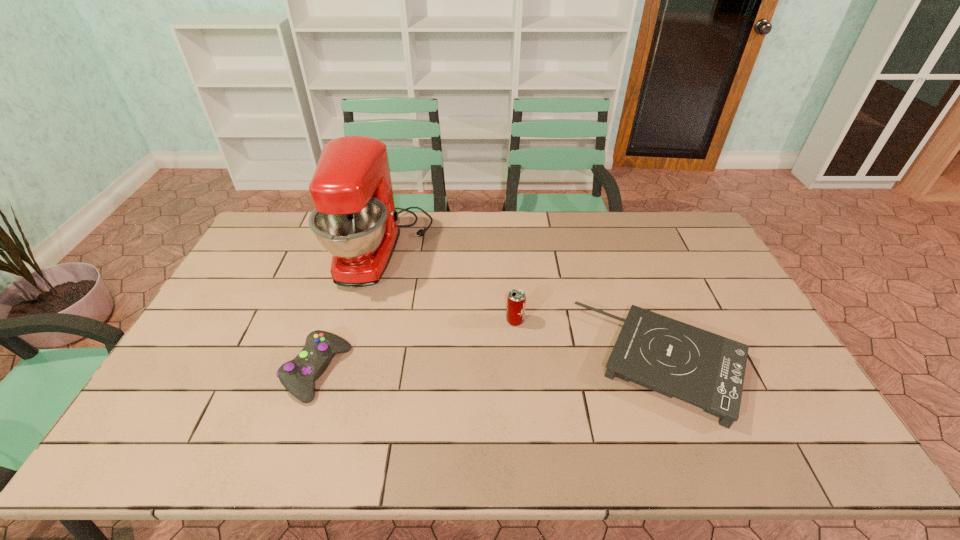
The image size is (960, 540). In order to click on vacant space situated on the left of the hotplate in this screenshot , I will do `click(458, 363)`.

At what (x,y) coordinates should I click in order to perform the action: click on object situated at the far edge. Please return your answer as a coordinate pair (x, y). Image resolution: width=960 pixels, height=540 pixels. Looking at the image, I should click on (354, 219).

This screenshot has height=540, width=960. In order to click on object situated at the near edge in this screenshot , I will do `click(675, 359)`.

Find the location of a particular element. object located in the right edge section of the desktop is located at coordinates (675, 359).

The image size is (960, 540). I want to click on object that is at the near right corner, so click(x=675, y=359).

At what (x,y) coordinates should I click in order to perform the action: click on vacant space at the far edge. Please return your answer as a coordinate pair (x, y). This screenshot has height=540, width=960. Looking at the image, I should click on (433, 233).

The image size is (960, 540). What are the coordinates of `blank area at the near edge` in the screenshot? It's located at (232, 429).

Image resolution: width=960 pixels, height=540 pixels. In the image, there is a desktop. What are the coordinates of `vacant space at the left edge` in the screenshot? It's located at (269, 265).

Locate an element on the screen. The image size is (960, 540). free spot at the right edge of the desktop is located at coordinates (720, 327).

In the image, there is a desktop. What are the coordinates of `vacant space at the near left corner` in the screenshot? It's located at click(175, 450).